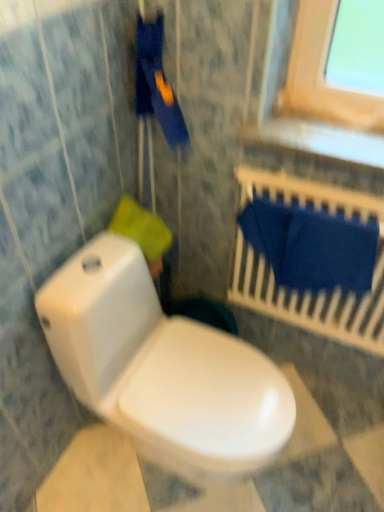
Question: Is blue fabric at upper right bigger than white glossy toilet at lower left?

Choices:
 (A) no
 (B) yes

Answer: (A)

Question: Is white glossy toilet at lower left surrounded by blue fabric at upper right?

Choices:
 (A) yes
 (B) no

Answer: (B)

Question: Is blue fabric at upper right wider than white glossy toilet at lower left?

Choices:
 (A) yes
 (B) no

Answer: (B)

Question: Is the depth of blue fabric at upper right less than that of white glossy toilet at lower left?

Choices:
 (A) no
 (B) yes

Answer: (A)

Question: Considering the relative positions of blue fabric at upper right and white glossy toilet at lower left in the image provided, is blue fabric at upper right to the right of white glossy toilet at lower left from the viewer's perspective?

Choices:
 (A) no
 (B) yes

Answer: (B)

Question: Is blue fabric at upper right facing away from white glossy toilet at lower left?

Choices:
 (A) yes
 (B) no

Answer: (B)

Question: Is white glossy toilet at lower left positioned behind yellow fabric at upper left?

Choices:
 (A) yes
 (B) no

Answer: (B)

Question: Considering the relative sizes of white glossy toilet at lower left and yellow fabric at upper left in the image provided, is white glossy toilet at lower left shorter than yellow fabric at upper left?

Choices:
 (A) no
 (B) yes

Answer: (A)

Question: Is white glossy toilet at lower left far from yellow fabric at upper left?

Choices:
 (A) yes
 (B) no

Answer: (B)

Question: Is white glossy toilet at lower left to the left of yellow fabric at upper left from the viewer's perspective?

Choices:
 (A) yes
 (B) no

Answer: (B)

Question: From the image's perspective, would you say white glossy toilet at lower left is shown under yellow fabric at upper left?

Choices:
 (A) yes
 (B) no

Answer: (A)

Question: Does white glossy toilet at lower left have a greater height compared to yellow fabric at upper left?

Choices:
 (A) no
 (B) yes

Answer: (B)

Question: Does white glossy toilet at lower left have a greater height compared to blue fabric at upper right?

Choices:
 (A) yes
 (B) no

Answer: (A)